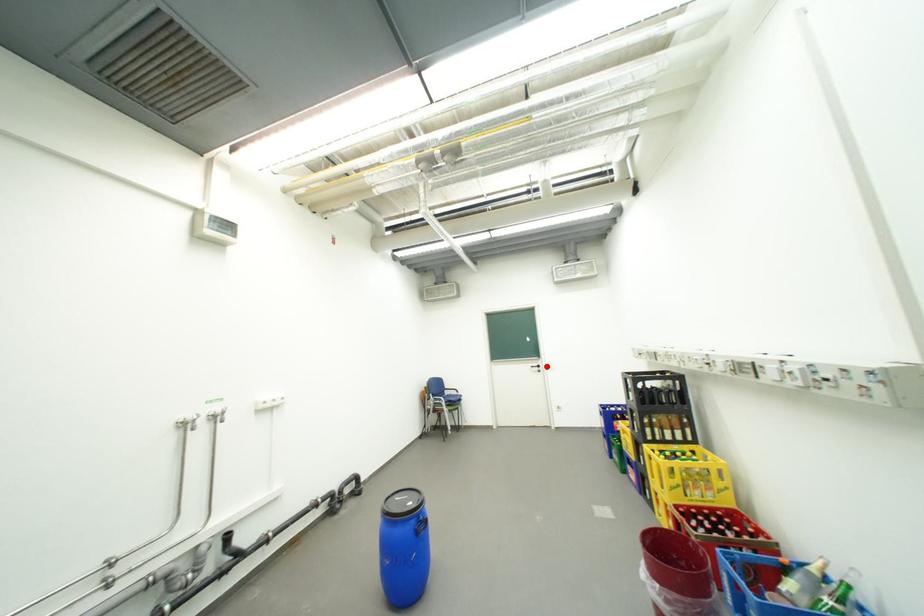
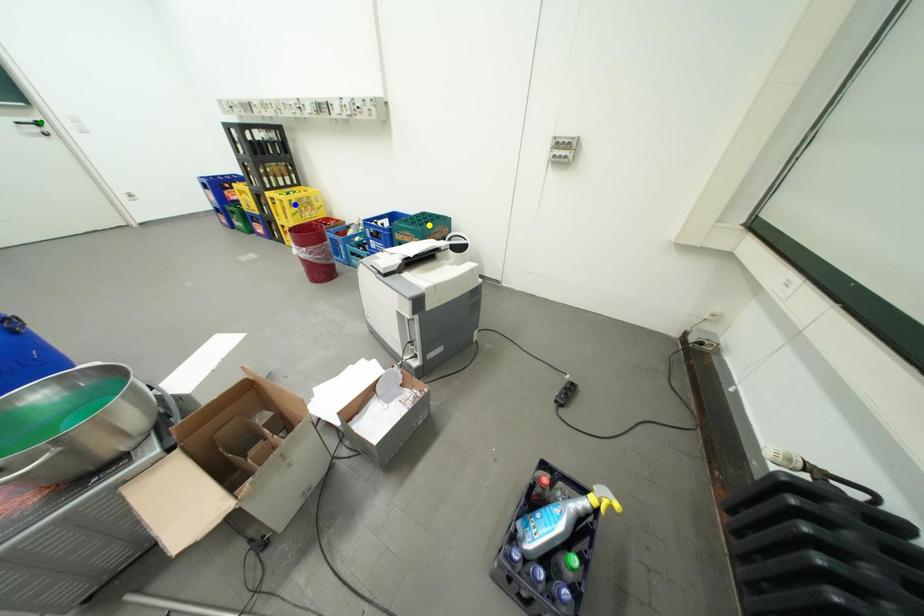
Question: I am providing you with two images of the same scene from different viewpoints. A red point is marked on the first image. You are given multiple points on the second image. Which point in image 2 represents the same 3d spot as the red point in image 1?

Choices:
 (A) yellow point
 (B) blue point
 (C) green point

Answer: (C)